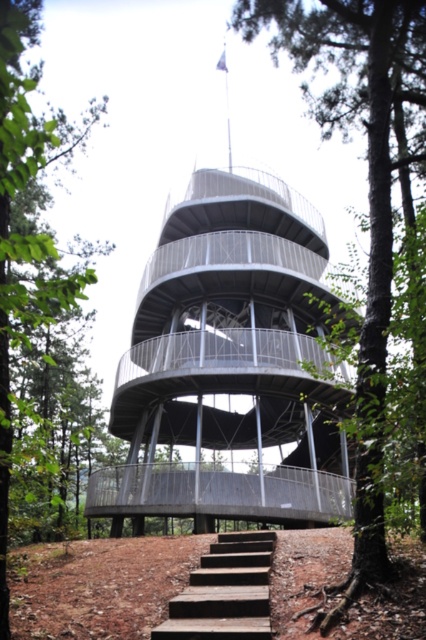
Between point (163, 509) and point (215, 586), which one is positioned behind?

Point (163, 509)

From the picture: Does metallic gray observation tower at center have a smaller size compared to wooden stairs at lower center?

Actually, metallic gray observation tower at center might be larger than wooden stairs at lower center.

You are a GUI agent. You are given a task and a screenshot of the screen. Output one action in this format:
    pyautogui.click(x=<x>, y=<y>)
    Task: Click on the metallic gray observation tower at center
    The width and height of the screenshot is (426, 640).
    Given the screenshot: What is the action you would take?
    pyautogui.click(x=229, y=364)

At what (x,y) coordinates should I click in order to perform the action: click on metallic gray observation tower at center. Please return your answer as a coordinate pair (x, y). Image resolution: width=426 pixels, height=640 pixels. Looking at the image, I should click on click(x=229, y=364).

Consider the image. Between metallic gray observation tower at center and green leafy tree at center, which one appears on the left side from the viewer's perspective?

green leafy tree at center

Can you confirm if metallic gray observation tower at center is positioned below green leafy tree at center?

No.

Image resolution: width=426 pixels, height=640 pixels. Describe the element at coordinates (229, 364) in the screenshot. I see `metallic gray observation tower at center` at that location.

You are a GUI agent. You are given a task and a screenshot of the screen. Output one action in this format:
    pyautogui.click(x=<x>, y=<y>)
    Task: Click on the metallic gray observation tower at center
    This screenshot has width=426, height=640.
    Given the screenshot: What is the action you would take?
    pyautogui.click(x=229, y=364)

Based on the photo, does smooth bark tree at center have a lesser width compared to green leafy tree at center?

Yes.

Measure the distance between smooth bark tree at center and camera.

The distance of smooth bark tree at center from camera is 5.11 meters.

Is point (370, 253) farther from camera compared to point (2, 468)?

Yes, it is behind point (2, 468).

Image resolution: width=426 pixels, height=640 pixels. In order to click on smooth bark tree at center in this screenshot , I will do `click(368, 195)`.